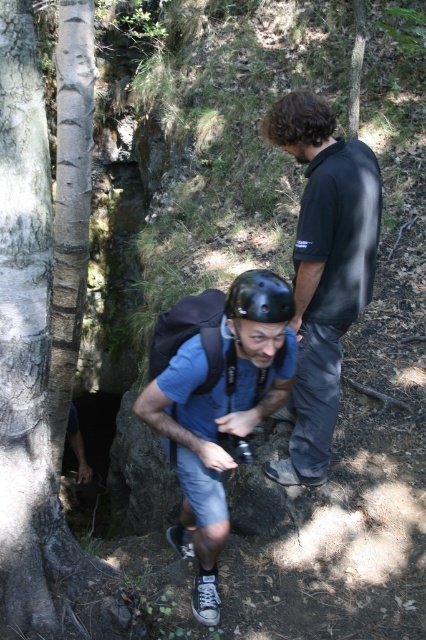
Question: Based on their relative distances, which object is nearer to the smooth bark tree at left?

Choices:
 (A) black matte helmet at center
 (B) black smooth shirt at upper center
 (C) blue fabric helmet at center

Answer: (C)

Question: Estimate the real-world distances between objects in this image. Which object is closer to the blue fabric helmet at center?

Choices:
 (A) black smooth shirt at upper center
 (B) smooth bark tree at left

Answer: (B)

Question: Is black smooth shirt at upper center positioned before blue fabric helmet at center?

Choices:
 (A) no
 (B) yes

Answer: (A)

Question: Is smooth bark tree at left further to camera compared to black matte helmet at center?

Choices:
 (A) no
 (B) yes

Answer: (B)

Question: In this image, where is black smooth shirt at upper center located relative to black matte helmet at center?

Choices:
 (A) above
 (B) below

Answer: (A)

Question: Among these points, which one is nearest to the camera?

Choices:
 (A) (276, 292)
 (B) (219, 481)
 (C) (373, 216)

Answer: (A)